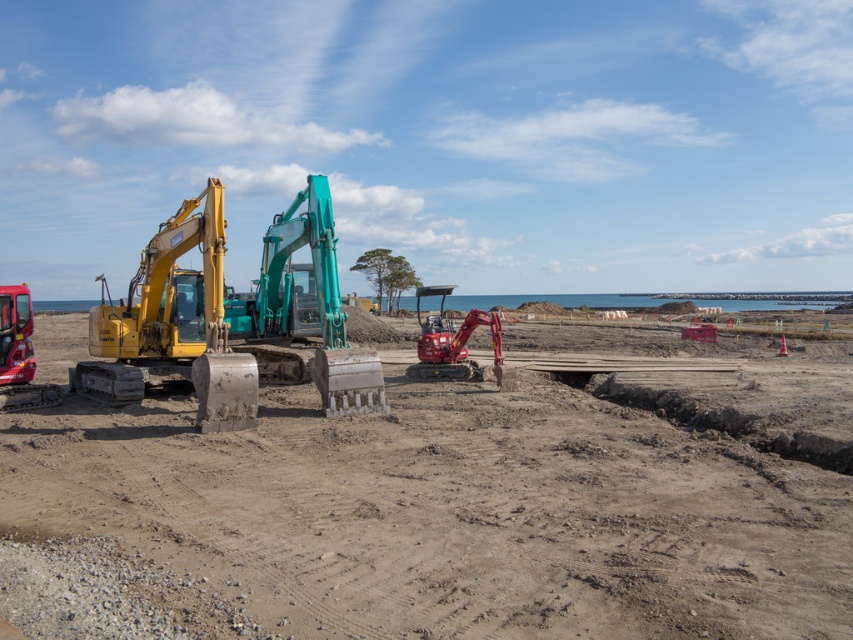
Question: Observing the image, what is the correct spatial positioning of yellow metallic excavator at left in reference to matte red excavator at center?

Choices:
 (A) right
 (B) left

Answer: (B)

Question: Which object is closer to the camera taking this photo?

Choices:
 (A) matte red excavator at center
 (B) yellow metallic excavator at left
 (C) brown sandy beach at center
 (D) teal metallic excavator at center

Answer: (C)

Question: In this image, where is yellow metallic excavator at left located relative to teal metallic excavator at center?

Choices:
 (A) left
 (B) right

Answer: (A)

Question: In this image, where is brown sandy beach at center located relative to matte red excavator at center?

Choices:
 (A) below
 (B) above

Answer: (A)

Question: Which point appears closest to the camera in this image?

Choices:
 (A) (148, 529)
 (B) (293, 205)
 (C) (474, 324)
 (D) (115, 312)

Answer: (A)

Question: Which of the following is the closest to the observer?

Choices:
 (A) (270, 301)
 (B) (503, 419)
 (C) (439, 365)

Answer: (B)